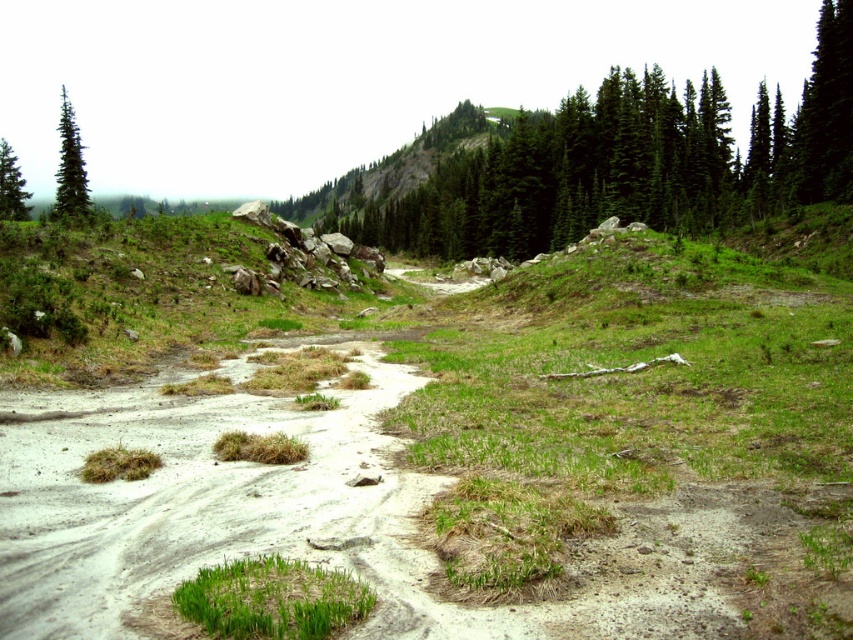
Question: Can you confirm if sandy/dry dirt track at lower left is positioned below green matte tree at upper left?

Choices:
 (A) yes
 (B) no

Answer: (A)

Question: Which point is closer to the camera taking this photo?

Choices:
 (A) [x=62, y=214]
 (B) [x=425, y=602]
 (C) [x=3, y=188]
 (D) [x=459, y=198]

Answer: (B)

Question: Which of these objects is positioned closest to the green textured tree at upper center?

Choices:
 (A) green matte tree at upper left
 (B) green matte evergreen tree at upper left
 (C) sandy/dry dirt track at lower left
 (D) green grassy patch at lower center

Answer: (D)

Question: Is green matte evergreen tree at upper left above green matte tree at upper left?

Choices:
 (A) no
 (B) yes

Answer: (B)

Question: Considering the relative positions of green grassy patch at lower center and green matte tree at upper left in the image provided, where is green grassy patch at lower center located with respect to green matte tree at upper left?

Choices:
 (A) above
 (B) below

Answer: (B)

Question: Estimate the real-world distances between objects in this image. Which object is closer to the green matte evergreen tree at upper left?

Choices:
 (A) green grassy patch at lower center
 (B) green matte tree at upper left
 (C) sandy/dry dirt track at lower left

Answer: (A)